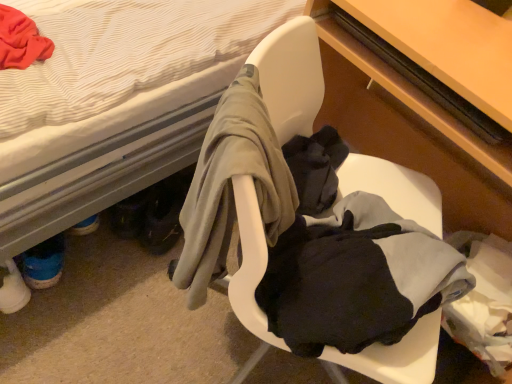
The width and height of the screenshot is (512, 384). I want to click on white plastic chair at center, so click(291, 76).

This screenshot has width=512, height=384. Find the location of `white plastic chair at center`. white plastic chair at center is located at coordinates (291, 76).

From a real-world perspective, who is located lower, matte wood desk at center or wooden table at right?

matte wood desk at center, from a real-world perspective.

In terms of width, does matte wood desk at center look wider or thinner when compared to wooden table at right?

matte wood desk at center is wider than wooden table at right.

Considering the positions of objects matte wood desk at center and wooden table at right in the image provided, who is more to the left, matte wood desk at center or wooden table at right?

From the viewer's perspective, wooden table at right appears more on the left side.

Does wooden table at right appear on the left side of white fabric bed at upper left?

In fact, wooden table at right is to the right of white fabric bed at upper left.

Is wooden table at right surrounding white fabric bed at upper left?

That's incorrect, white fabric bed at upper left is not inside wooden table at right.

From the image's perspective, between wooden table at right and white fabric bed at upper left, which one is located above?

white fabric bed at upper left.

Identify the location of table located on the right of white fabric bed at upper left. (405, 92).

Is wooden table at right oriented towards matte wood desk at center?

Yes, wooden table at right faces towards matte wood desk at center.

Is wooden table at right spatially inside matte wood desk at center, or outside of it?

wooden table at right can be found inside matte wood desk at center.

Is wooden table at right far away from matte wood desk at center?

No.

Is white plastic chair at center far away from white fabric bed at upper left?

They are positioned close to each other.

How many degrees apart are the facing directions of white plastic chair at center and white fabric bed at upper left?

The facing directions of white plastic chair at center and white fabric bed at upper left are 49.2 degrees apart.

Can you confirm if white plastic chair at center is positioned to the left of white fabric bed at upper left?

In fact, white plastic chair at center is to the right of white fabric bed at upper left.

Considering the relative sizes of white plastic chair at center and white fabric bed at upper left in the image provided, is white plastic chair at center smaller than white fabric bed at upper left?

Indeed, white plastic chair at center has a smaller size compared to white fabric bed at upper left.

Considering the relative sizes of white fabric bed at upper left and wooden table at right in the image provided, is white fabric bed at upper left thinner than wooden table at right?

No.

Is wooden table at right inside white fabric bed at upper left?

Definitely not — wooden table at right is not inside white fabric bed at upper left.

Can you confirm if white fabric bed at upper left is bigger than wooden table at right?

Yes.

In terms of width, does white fabric bed at upper left look wider or thinner when compared to matte wood desk at center?

white fabric bed at upper left is wider than matte wood desk at center.

From the image's perspective, which is below, white fabric bed at upper left or matte wood desk at center?

matte wood desk at center is shown below in the image.

Considering the relative positions of white fabric bed at upper left and matte wood desk at center in the image provided, is white fabric bed at upper left to the right of matte wood desk at center from the viewer's perspective?

Incorrect, white fabric bed at upper left is not on the right side of matte wood desk at center.

Relative to matte wood desk at center, is white fabric bed at upper left in front or behind?

Clearly, white fabric bed at upper left is in front of matte wood desk at center.

Is white plastic chair at center taller or shorter than matte wood desk at center?

Considering their sizes, white plastic chair at center has less height than matte wood desk at center.

Considering the points (236, 310) and (387, 17), which point is in front, point (236, 310) or point (387, 17)?

The point (236, 310) is more forward.

Which object is further away from the camera, white plastic chair at center or matte wood desk at center?

Positioned behind is matte wood desk at center.

Is matte wood desk at center a part of white plastic chair at center?

Yes, matte wood desk at center can be found within white plastic chair at center.

Identify the location of desk that is on the right side of wooden table at right. This screenshot has height=384, width=512. (412, 130).

Find the location of a particular element. bed located above the wooden table at right (from the image's perspective) is located at coordinates (104, 172).

Estimate the real-world distances between objects in this image. Which object is closer to white fabric bed at upper left, white plastic chair at center or matte wood desk at center?

Based on the image, white plastic chair at center appears to be nearer to white fabric bed at upper left.

From the image, which object appears to be farther from white fabric bed at upper left, wooden table at right or white plastic chair at center?

wooden table at right lies further to white fabric bed at upper left than the other object.

When comparing their distances from matte wood desk at center, does white fabric bed at upper left or wooden table at right seem further?

Among the two, white fabric bed at upper left is located further to matte wood desk at center.

When comparing their distances from white fabric bed at upper left, does matte wood desk at center or wooden table at right seem closer?

wooden table at right is closer to white fabric bed at upper left.

Which object lies further to the anchor point matte wood desk at center, white plastic chair at center or wooden table at right?

white plastic chair at center.

Estimate the real-world distances between objects in this image. Which object is further from wooden table at right, white plastic chair at center or matte wood desk at center?

white plastic chair at center is positioned further to the anchor wooden table at right.

Looking at the image, which one is located further to white fabric bed at upper left, matte wood desk at center or white plastic chair at center?

matte wood desk at center lies further to white fabric bed at upper left than the other object.

Which object lies nearer to the anchor point white plastic chair at center, white fabric bed at upper left or matte wood desk at center?

matte wood desk at center is closer to white plastic chair at center.

I want to click on table between white fabric bed at upper left and matte wood desk at center in the horizontal direction, so click(x=405, y=92).

Locate an element on the screen. desk that lies between wooden table at right and white plastic chair at center from top to bottom is located at coordinates (412, 130).

Find the location of a particular element. This screenshot has height=384, width=512. chair between white fabric bed at upper left and wooden table at right in the horizontal direction is located at coordinates (291, 76).

The width and height of the screenshot is (512, 384). Identify the location of chair between white fabric bed at upper left and matte wood desk at center. (291, 76).